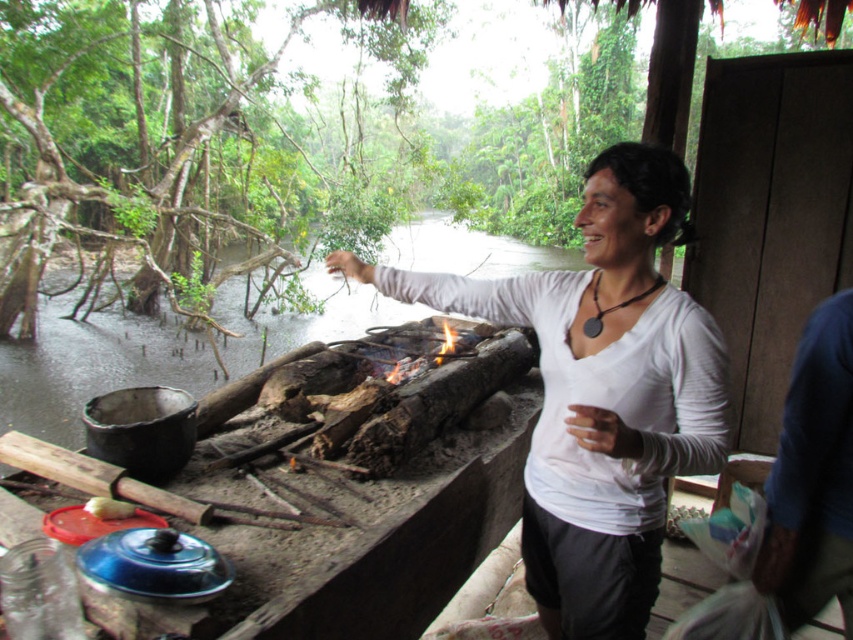
Question: Can you confirm if white matte shirt at center is positioned below blue fabric shirt at right?

Choices:
 (A) no
 (B) yes

Answer: (A)

Question: Where is white matte shirt at center located in relation to blue fabric shirt at right in the image?

Choices:
 (A) right
 (B) left

Answer: (B)

Question: Among these objects, which one is farthest from the camera?

Choices:
 (A) white matte shirt at center
 (B) blue fabric shirt at right

Answer: (B)

Question: Can you confirm if white matte shirt at center is positioned to the left of blue fabric shirt at right?

Choices:
 (A) no
 (B) yes

Answer: (B)